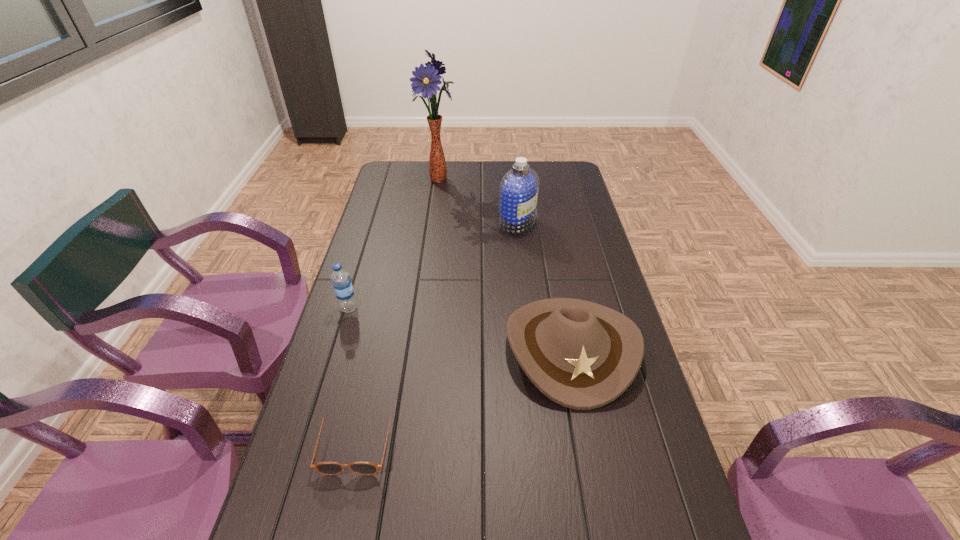
Locate an element on the screen. The height and width of the screenshot is (540, 960). object that is the third closest to the tallest object is located at coordinates (341, 280).